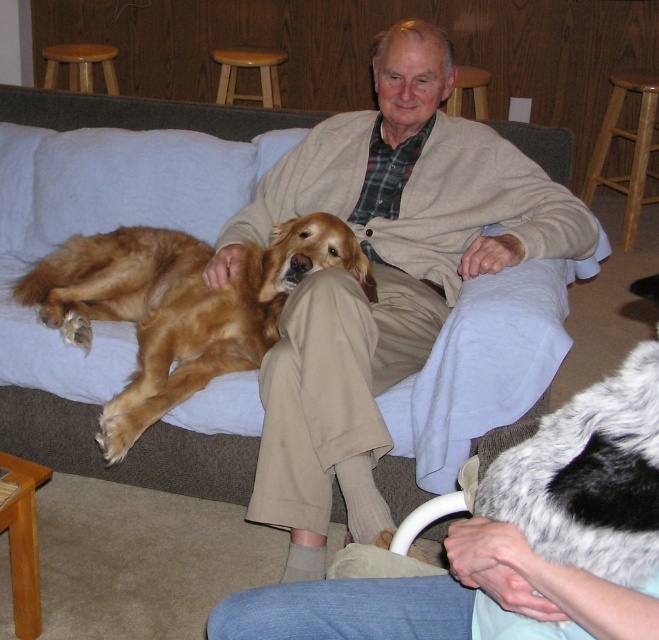
Which is more to the right, golden fur dog at center or soft gray couch at center?

Positioned to the right is soft gray couch at center.

Does golden fur dog at center lie in front of soft gray couch at center?

Yes.

Measure the distance between point (32, 288) and camera.

Point (32, 288) is 2.24 meters from camera.

Where is `golden fur dog at center`? golden fur dog at center is located at coordinates (179, 307).

Does golden fur dog at center appear under wooden stool at right?

Indeed, golden fur dog at center is positioned under wooden stool at right.

Describe the element at coordinates (179, 307) in the screenshot. The image size is (659, 640). I see `golden fur dog at center` at that location.

Identify the location of golden fur dog at center. Image resolution: width=659 pixels, height=640 pixels. (179, 307).

Does wooden stool at right appear on the right side of wooden stool at upper center?

Yes, wooden stool at right is to the right of wooden stool at upper center.

The width and height of the screenshot is (659, 640). Find the location of `wooden stool at right`. wooden stool at right is located at coordinates tap(633, 147).